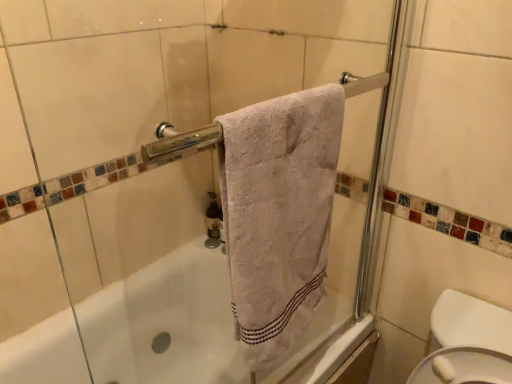
Where is `white textured towel at center`? The width and height of the screenshot is (512, 384). white textured towel at center is located at coordinates (279, 214).

The image size is (512, 384). Describe the element at coordinates (279, 214) in the screenshot. I see `white textured towel at center` at that location.

Describe the element at coordinates (213, 217) in the screenshot. This screenshot has width=512, height=384. I see `matte brown soap dispenser at center` at that location.

The width and height of the screenshot is (512, 384). Find the location of `matte brown soap dispenser at center`. matte brown soap dispenser at center is located at coordinates (213, 217).

Image resolution: width=512 pixels, height=384 pixels. What are the coordinates of `white textured towel at center` in the screenshot? It's located at (279, 214).

Would you say white textured towel at center is to the left or to the right of matte brown soap dispenser at center in the picture?

From the image, it's evident that white textured towel at center is to the right of matte brown soap dispenser at center.

From the picture: Considering the positions of objects white textured towel at center and matte brown soap dispenser at center in the image provided, who is behind, white textured towel at center or matte brown soap dispenser at center?

Positioned behind is matte brown soap dispenser at center.

Considering the points (312, 176) and (207, 219), which point is in front, point (312, 176) or point (207, 219)?

The point (312, 176) is in front.

From the image's perspective, is white textured towel at center below matte brown soap dispenser at center?

No, from the image's perspective, white textured towel at center is not below matte brown soap dispenser at center.

From a real-world perspective, which object stands above the other?

white textured towel at center is physically above.

Considering the sizes of white textured towel at center and matte brown soap dispenser at center in the image, is white textured towel at center wider or thinner than matte brown soap dispenser at center?

white textured towel at center is wider than matte brown soap dispenser at center.

Between white textured towel at center and matte brown soap dispenser at center, which one has less height?

matte brown soap dispenser at center is shorter.

Based on the photo, considering the relative sizes of white textured towel at center and matte brown soap dispenser at center in the image provided, is white textured towel at center bigger than matte brown soap dispenser at center?

Correct, white textured towel at center is larger in size than matte brown soap dispenser at center.

Choose the correct answer: Is white textured towel at center inside matte brown soap dispenser at center or outside it?

white textured towel at center is not inside matte brown soap dispenser at center, it's outside.

Is white textured towel at center not near matte brown soap dispenser at center?

Actually, white textured towel at center and matte brown soap dispenser at center are a little close together.

Could you tell me if white textured towel at center is turned towards matte brown soap dispenser at center?

No, white textured towel at center is not turned towards matte brown soap dispenser at center.

How different are the orientations of white textured towel at center and matte brown soap dispenser at center in degrees?

They differ by 86.9 degrees in their facing directions.

This screenshot has height=384, width=512. I want to click on toiletry lying behind the white textured towel at center, so click(213, 217).

Considering the relative positions of matte brown soap dispenser at center and white textured towel at center in the image provided, is matte brown soap dispenser at center to the left of white textured towel at center from the viewer's perspective?

Yes, matte brown soap dispenser at center is to the left of white textured towel at center.

Is matte brown soap dispenser at center further to camera compared to white textured towel at center?

Yes.

Is point (215, 207) positioned before point (279, 97)?

That is True.

From the image's perspective, which is above, matte brown soap dispenser at center or white textured towel at center?

white textured towel at center, from the image's perspective.

From a real-world perspective, does matte brown soap dispenser at center sit lower than white textured towel at center?

Yes, from a real-world perspective, matte brown soap dispenser at center is under white textured towel at center.

Which object is thinner, matte brown soap dispenser at center or white textured towel at center?

matte brown soap dispenser at center.

In terms of height, does matte brown soap dispenser at center look taller or shorter compared to white textured towel at center?

In the image, matte brown soap dispenser at center appears to be shorter than white textured towel at center.

Who is bigger, matte brown soap dispenser at center or white textured towel at center?

white textured towel at center.

Is matte brown soap dispenser at center positioned beyond the bounds of white textured towel at center?

matte brown soap dispenser at center lies outside white textured towel at center's area.

Are matte brown soap dispenser at center and white textured towel at center far apart?

No.

Is matte brown soap dispenser at center facing towards white textured towel at center?

No, matte brown soap dispenser at center is not turned towards white textured towel at center.

Find the location of `toiletry below the white textured towel at center (from a real-world perspective)`. toiletry below the white textured towel at center (from a real-world perspective) is located at coordinates (213, 217).

The image size is (512, 384). I want to click on toiletry located behind the white textured towel at center, so click(x=213, y=217).

I want to click on towel that is above the matte brown soap dispenser at center (from a real-world perspective), so click(279, 214).